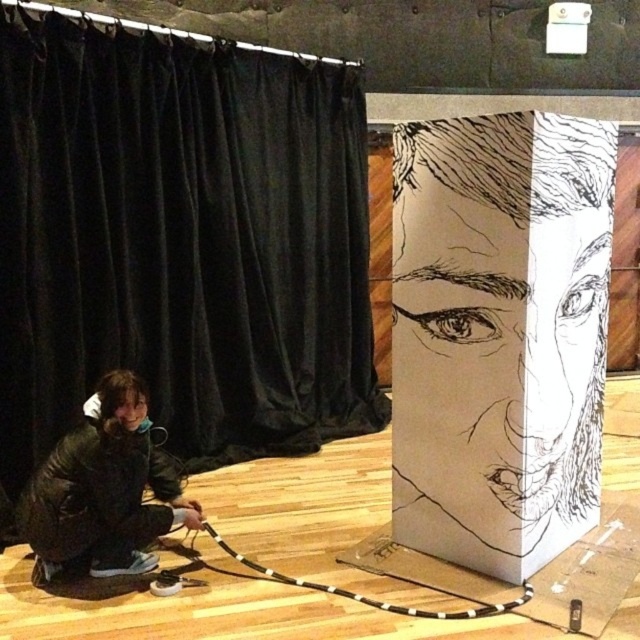
Question: Estimate the real-world distances between objects in this image. Which object is closer to the white paper drawing at center?

Choices:
 (A) black leather jacket at lower left
 (B) black velvet curtain at center

Answer: (A)

Question: Which object appears closest to the camera in this image?

Choices:
 (A) black velvet curtain at center
 (B) white paper drawing at center

Answer: (B)

Question: Does black velvet curtain at center have a smaller size compared to white paper drawing at center?

Choices:
 (A) no
 (B) yes

Answer: (A)

Question: Which object appears farthest from the camera in this image?

Choices:
 (A) black velvet curtain at center
 (B) white paper drawing at center
 (C) black leather jacket at lower left

Answer: (A)

Question: From the image, what is the correct spatial relationship of black velvet curtain at center in relation to white paper drawing at center?

Choices:
 (A) above
 (B) below

Answer: (A)

Question: Does white paper drawing at center have a greater width compared to black leather jacket at lower left?

Choices:
 (A) yes
 (B) no

Answer: (A)